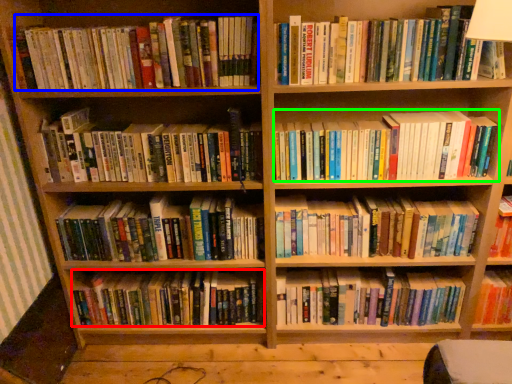
Question: Based on their relative distances, which object is farther from book (highlighted by a red box)? Choose from book (highlighted by a blue box) and book (highlighted by a green box).

Choices:
 (A) book
 (B) book

Answer: (A)